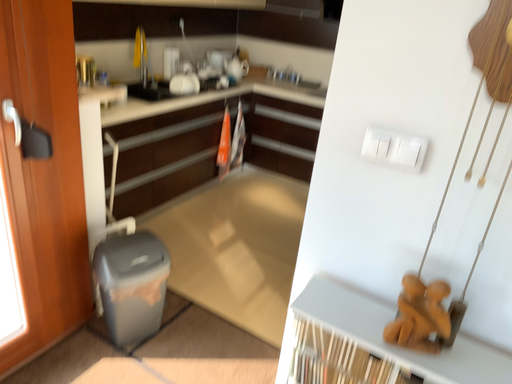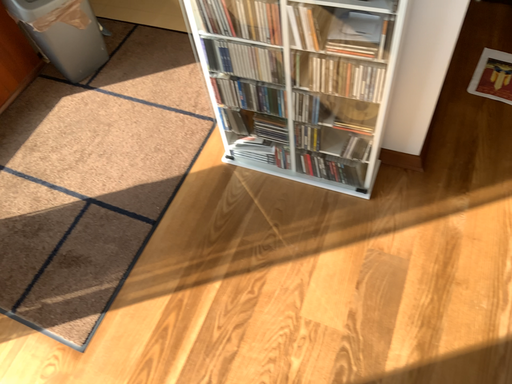
Question: Which way did the camera rotate in the video?

Choices:
 (A) rotated downward
 (B) rotated upward

Answer: (A)